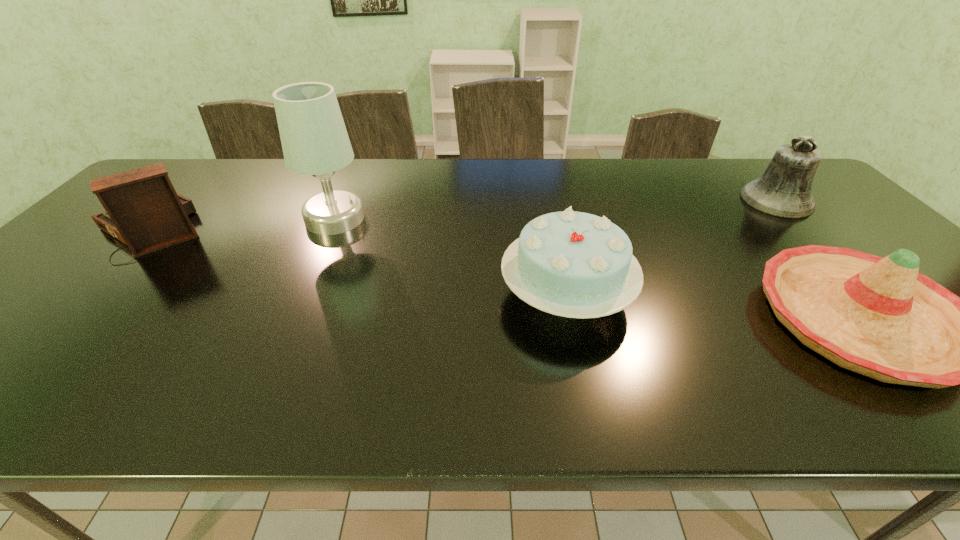
Find the location of a particular element. object at the left edge is located at coordinates (143, 210).

Locate an element on the screen. Image resolution: width=960 pixels, height=540 pixels. object located in the right edge section of the desktop is located at coordinates (784, 189).

Where is `object at the far right corner`? This screenshot has width=960, height=540. object at the far right corner is located at coordinates (x=784, y=189).

Find the location of a particular element. vacant region at the far edge of the desktop is located at coordinates (280, 168).

Image resolution: width=960 pixels, height=540 pixels. In the image, there is a desktop. Find the location of `vacant space at the near edge`. vacant space at the near edge is located at coordinates (378, 395).

Locate an element on the screen. The height and width of the screenshot is (540, 960). vacant space at the left edge is located at coordinates (68, 280).

I want to click on vacant area that lies between the third object from left to right and the second object from left to right, so click(x=451, y=256).

Locate an element on the screen. The image size is (960, 540). empty location between the lampshade and the birthday cake is located at coordinates (451, 256).

The height and width of the screenshot is (540, 960). What are the coordinates of `vacant point located between the bell and the lampshade` in the screenshot? It's located at (556, 209).

The image size is (960, 540). In order to click on vacant space in between the phonograph record and the fourth object from right to left in this screenshot , I will do `click(244, 224)`.